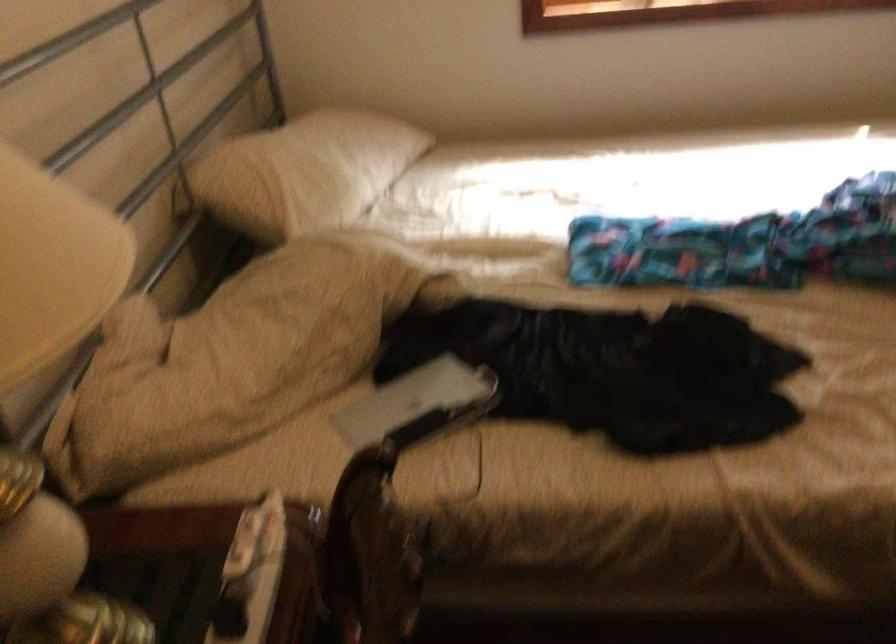
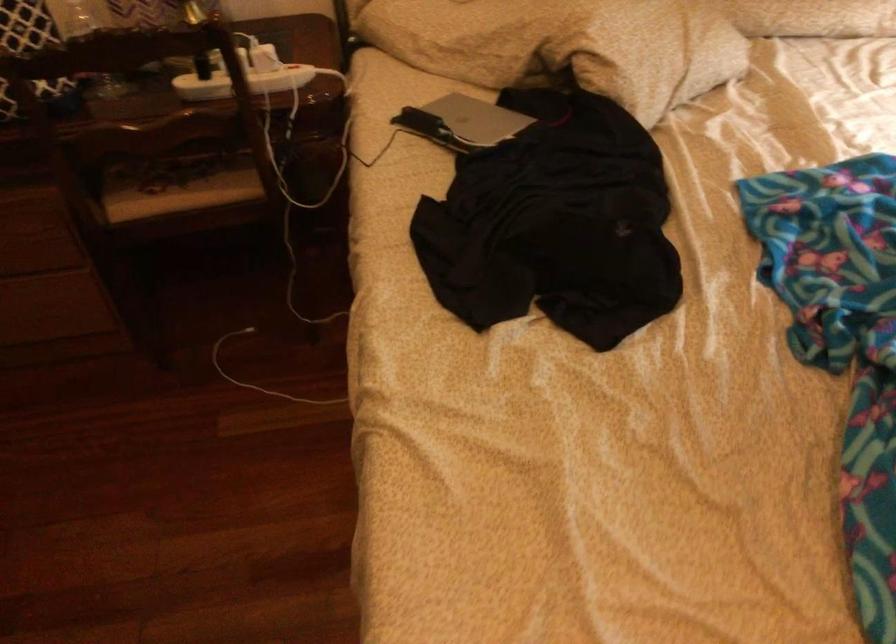
Find the pixel in the second image that matches point (342, 553) in the first image.

(243, 82)